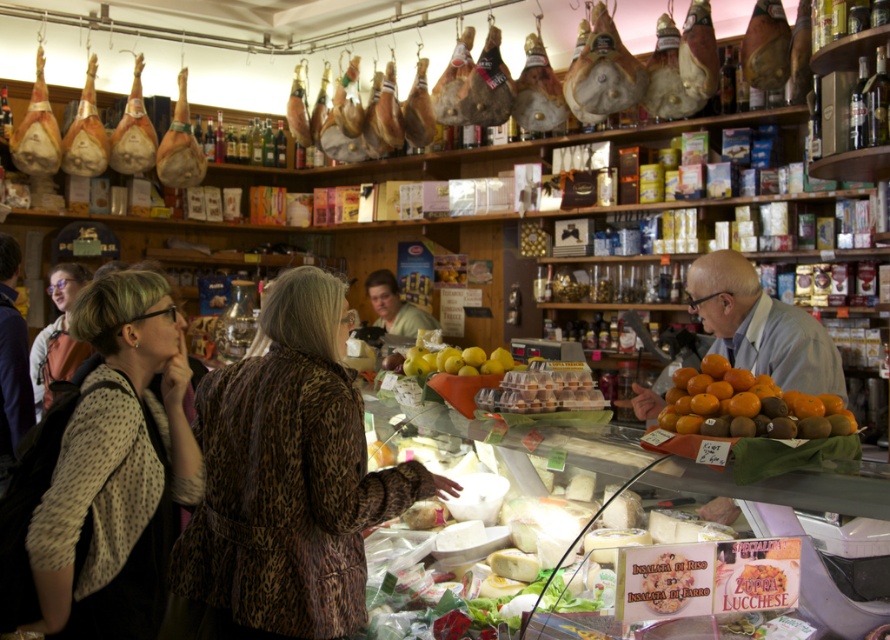
You are a customer in this deli and want to pick up both the leopard print coat at center and the matte black jacket at left. Which one can you reach without moving closer to the counter?

The leopard print coat at center is closer to the viewer than the matte black jacket at left, so you can reach it without moving closer to the counter.

You are a customer in the deli and want to pick up both the patterned fabric jacket at center and the matte black jacket at left. Which jacket should you reach for first to grab them efficiently?

The patterned fabric jacket at center is closer to you than the matte black jacket at left, so you should reach for the patterned fabric jacket at center first.